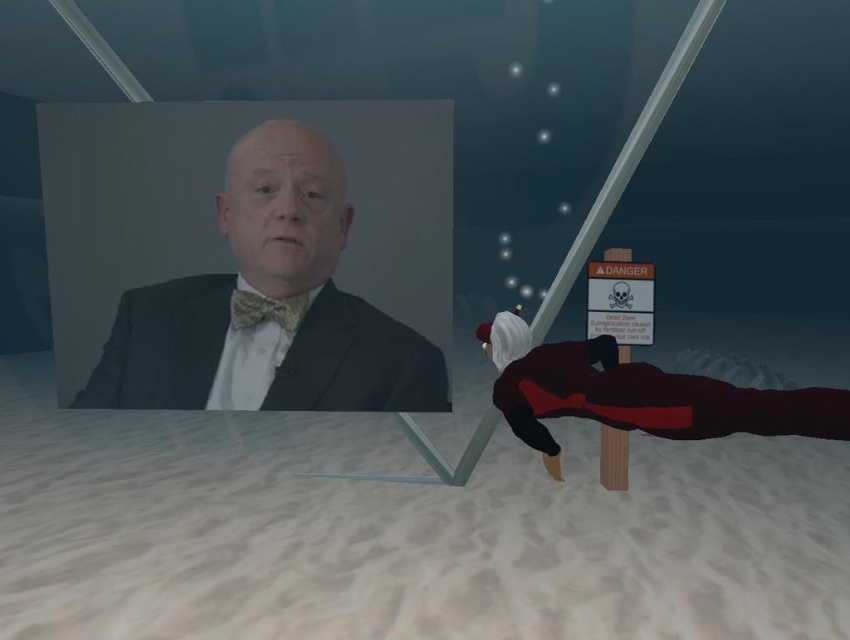
Does matte black suit at upper left lie in front of gold textured bow tie at center?

That is True.

Can you confirm if matte black suit at upper left is smaller than gold textured bow tie at center?

No, matte black suit at upper left is not smaller than gold textured bow tie at center.

In order to click on matte black suit at upper left in this screenshot , I will do `click(269, 298)`.

Locate an element on the screen. matte black suit at upper left is located at coordinates (269, 298).

From the picture: Which is more to the left, white sandy beach at lower center or gold textured bow tie at center?

Positioned to the left is white sandy beach at lower center.

Is white sandy beach at lower center below gold textured bow tie at center?

Correct, white sandy beach at lower center is located below gold textured bow tie at center.

Who is more forward, (x=802, y=444) or (x=251, y=316)?

Positioned in front is point (x=251, y=316).

At what (x,y) coordinates should I click in order to perform the action: click on white sandy beach at lower center. Please return your answer as a coordinate pair (x, y). Looking at the image, I should click on (401, 531).

Does white sandy beach at lower center have a smaller size compared to matte black suit at left?

Yes.

Is white sandy beach at lower center above matte black suit at left?

Incorrect, white sandy beach at lower center is not positioned above matte black suit at left.

Where is `white sandy beach at lower center`? Image resolution: width=850 pixels, height=640 pixels. white sandy beach at lower center is located at coordinates [x=401, y=531].